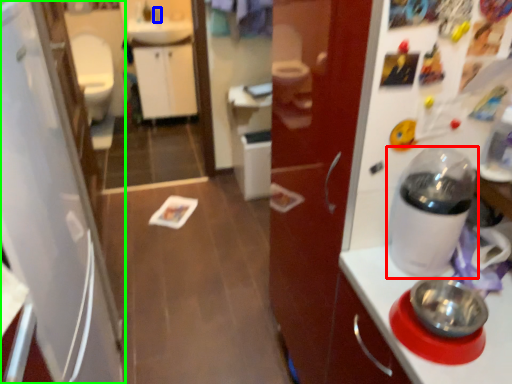
Question: Estimate the real-world distances between objects in this image. Which object is closer to home appliance (highlighted by a red box), faucet (highlighted by a blue box) or refrigerator (highlighted by a green box)?

Choices:
 (A) faucet
 (B) refrigerator

Answer: (B)